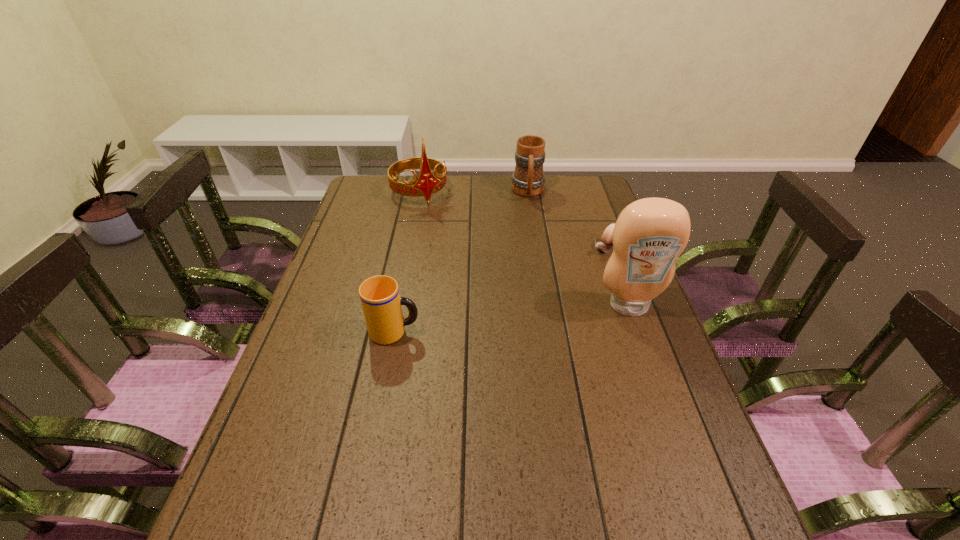
Locate an element on the screen. The height and width of the screenshot is (540, 960). vacant region located on the side of the mug with the handle is located at coordinates (531, 238).

Locate an element on the screen. The image size is (960, 540). vacant region located on the side of the mug with the handle is located at coordinates tap(530, 215).

In order to click on vacant space located 0.350m on the front-facing side of the escargot in this screenshot , I will do `click(521, 312)`.

Where is `blank space located on the front-facing side of the escargot`? blank space located on the front-facing side of the escargot is located at coordinates (563, 280).

Locate an element on the screen. Image resolution: width=960 pixels, height=540 pixels. free space located 0.300m on the front-facing side of the escargot is located at coordinates (534, 302).

Where is `vacant area situated 0.070m on the front-facing side of the tiara`? vacant area situated 0.070m on the front-facing side of the tiara is located at coordinates (436, 218).

The height and width of the screenshot is (540, 960). I want to click on vacant position located on the front-facing side of the tiara, so click(x=454, y=245).

Image resolution: width=960 pixels, height=540 pixels. I want to click on vacant space located on the front-facing side of the tiara, so click(442, 227).

At what (x,y) coordinates should I click in order to perform the action: click on mug located at the far edge. Please return your answer as a coordinate pair (x, y). This screenshot has height=540, width=960. Looking at the image, I should click on (528, 180).

Locate an element on the screen. The image size is (960, 540). tiara that is at the far edge is located at coordinates (427, 183).